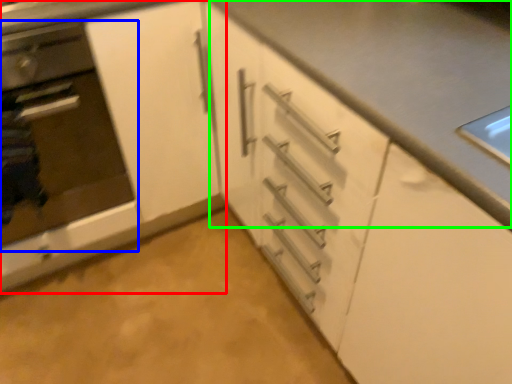
Question: Which is farther away from cabinetry (highlighted by a red box)? oven (highlighted by a blue box) or counter top (highlighted by a green box)?

Choices:
 (A) oven
 (B) counter top

Answer: (B)